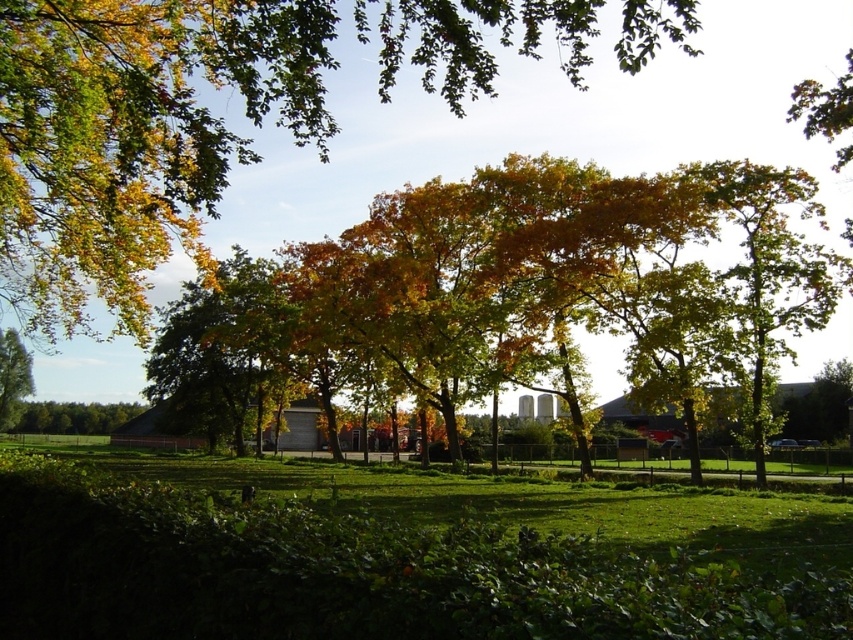
You are standing in the field and want to know which tree has a larger canopy. Which one is wider between the green leafy tree at upper center and the green leafy tree at left?

The green leafy tree at upper center might be wider than the green leafy tree at left according to the description.

You are planning to install a fence between the green leafy tree at upper center and the green leafy tree at left. The fence needs to be exactly 150 feet long. Based on the scene, will the fence fit perfectly between them?

The distance between the green leafy tree at upper center and the green leafy tree at left is 147.99 feet, which is slightly shorter than the 150 feet required for the fence. Therefore, the fence will not fit perfectly between them as it is 2.01 feet too long.